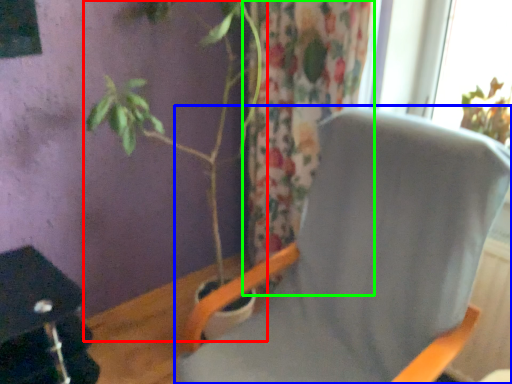
Question: Which is nearer to the houseplant (highlighted by a red box)? chair (highlighted by a blue box) or curtain (highlighted by a green box).

Choices:
 (A) chair
 (B) curtain

Answer: (B)